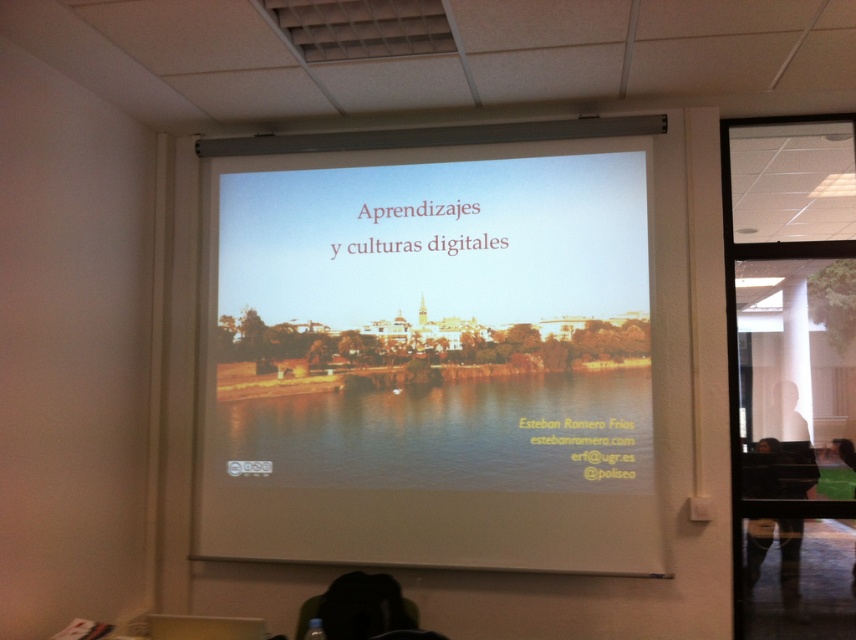
Question: Which of the following is the farthest from the observer?

Choices:
 (A) dark hair at lower right
 (B) white glossy projector screen at center

Answer: (A)

Question: From the image, what is the correct spatial relationship of white glossy projector screen at center in relation to dark hair at lower right?

Choices:
 (A) right
 (B) left

Answer: (B)

Question: Which object is closer to the camera taking this photo?

Choices:
 (A) white glossy projector screen at center
 (B) dark hair at lower right

Answer: (A)

Question: From the image, what is the correct spatial relationship of white glossy projector screen at center in relation to dark hair at lower right?

Choices:
 (A) below
 (B) above

Answer: (B)

Question: Can you confirm if white glossy projector screen at center is wider than dark hair at lower right?

Choices:
 (A) no
 (B) yes

Answer: (B)

Question: Among these points, which one is nearest to the camera?

Choices:
 (A) (773, 448)
 (B) (408, 170)

Answer: (A)